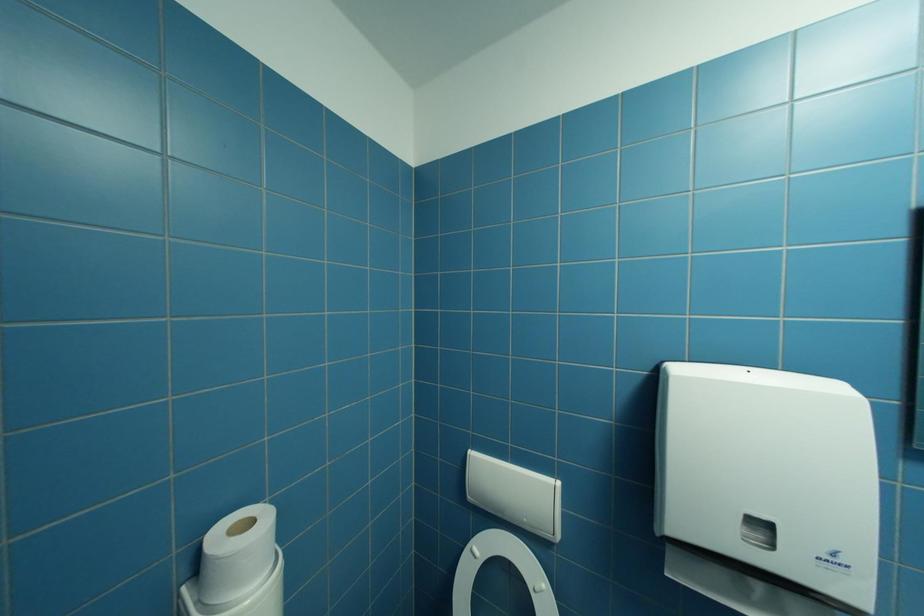
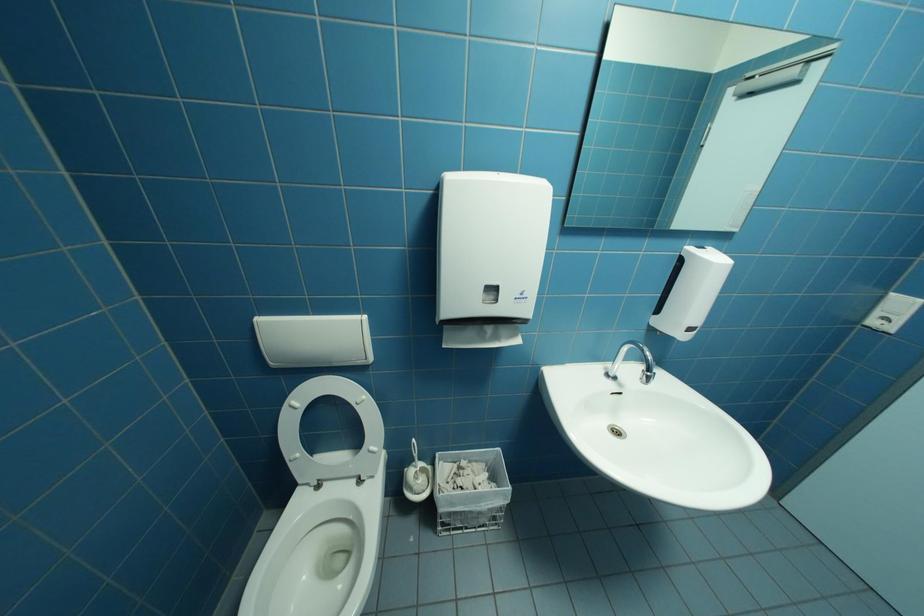
The images are taken continuously from a first-person perspective. In which direction is your viewpoint rotating?

The camera's rotation is toward right-down.